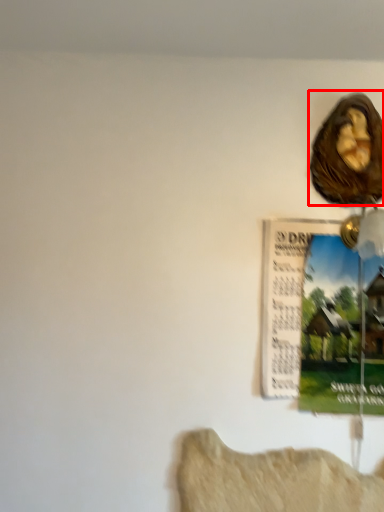
Question: Observing the image, what is the correct spatial positioning of art (annotated by the red box) in reference to poster page?

Choices:
 (A) right
 (B) left

Answer: (A)